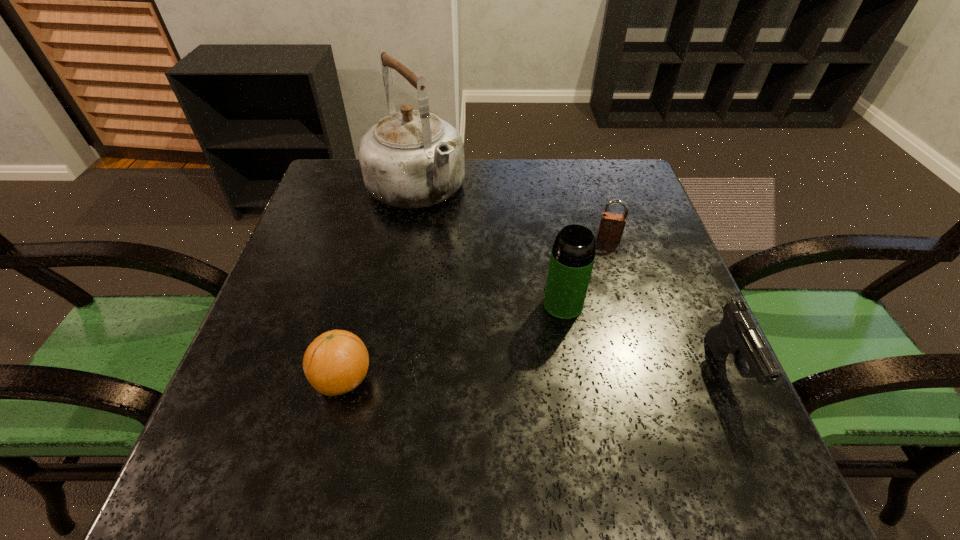
Locate an element on the screen. vacant space on the desktop that is between the orange and the rightmost object and is positioned on the front-facing side of the fourth nearest object is located at coordinates (593, 373).

Where is `free space on the desktop that is between the orange and the rightmost object and is positioned from the spout of the fourth shortest object`? This screenshot has height=540, width=960. free space on the desktop that is between the orange and the rightmost object and is positioned from the spout of the fourth shortest object is located at coordinates (505, 375).

In order to click on vacant spot on the desktop that is between the orange and the rightmost object and is positioned at the spout of the tallest object in this screenshot , I will do `click(584, 373)`.